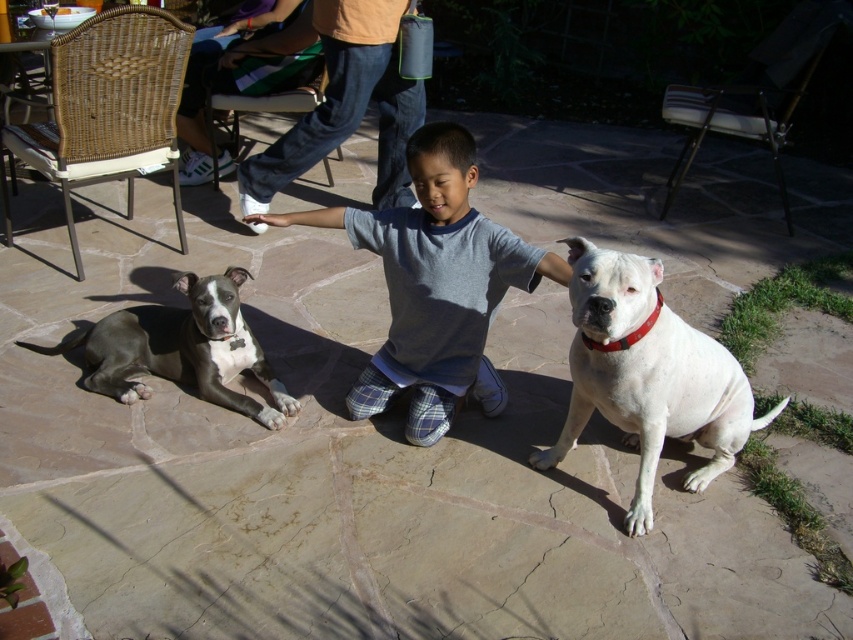
You are standing at the point marked by coordinates point (434, 285). You want to move towards the brindle dog lying on the left. Is the brindle dog to your left or right?

The brindle dog lying on the left is to your left side.